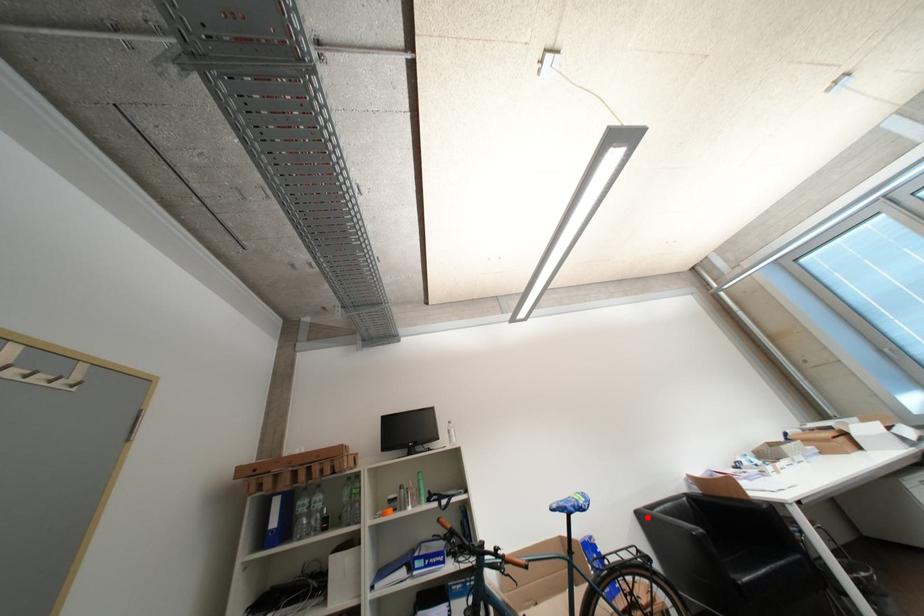
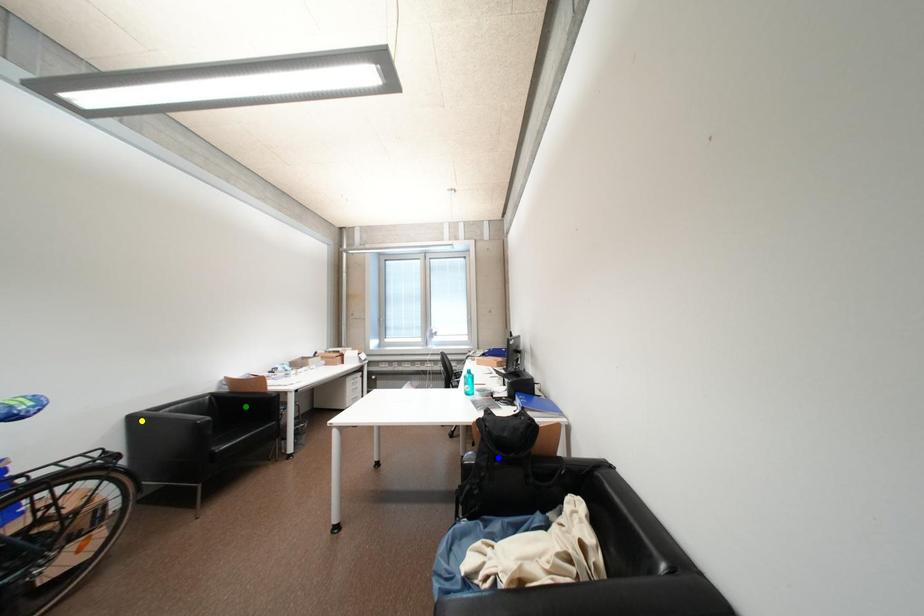
Question: I am providing you with two images of the same scene from different viewpoints. A red point is marked on the first image. You are given multiple points on the second image. Which spot in image 2 lines up with the point in image 1?

Choices:
 (A) yellow point
 (B) blue point
 (C) green point

Answer: (A)